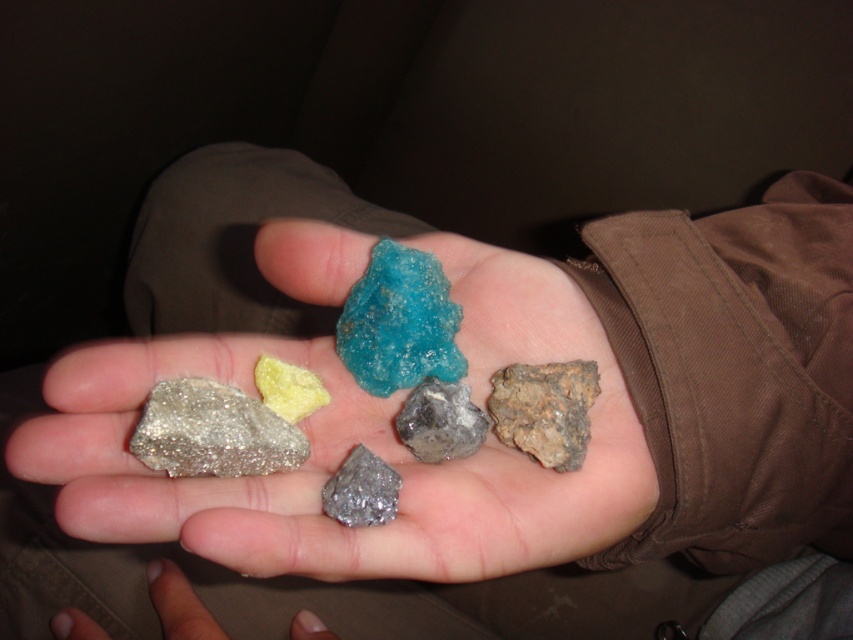
You are an archaeologist examining the rocks in the hand. You want to pick up the yellow crystalline mineral at center without touching the matte silver rock at center. Is this possible based on their positions?

The matte silver rock at center is closer to you than the yellow crystalline mineral at center, so you can reach the yellow crystalline mineral at center without touching the matte silver rock at center by moving your hand around the matte silver rock at center.

You are a geologist examining the rocks in the hand. You notice two specific rocks labeled as the sparkly silver rock at center and the yellow crystalline mineral at center. Which of these two rocks is positioned closer to your eyes?

The sparkly silver rock at center is closer to the viewer than the yellow crystalline mineral at center.